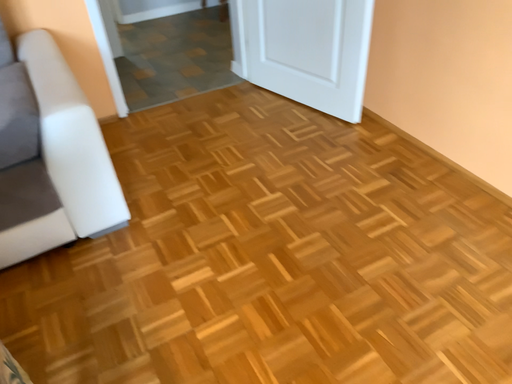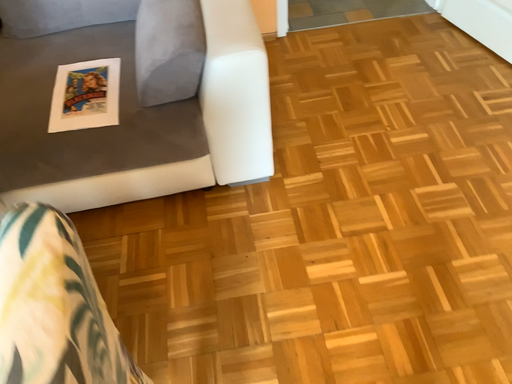
Question: Which way did the camera rotate in the video?

Choices:
 (A) rotated upward
 (B) rotated downward

Answer: (B)